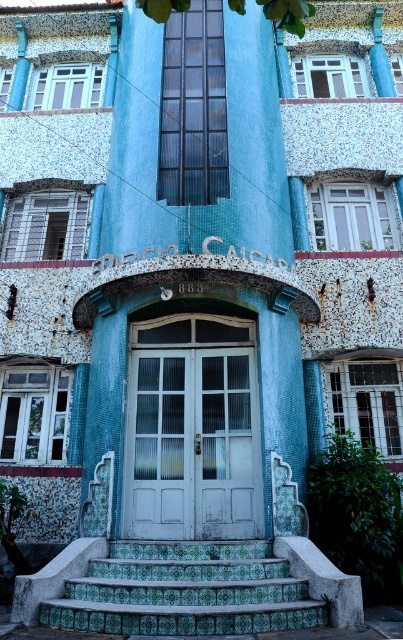
Question: Which of the following is the farthest from the observer?

Choices:
 (A) (203, 340)
 (B) (87, 595)

Answer: (A)

Question: Is white matte door at center bigger than green tile stairs at center?

Choices:
 (A) no
 (B) yes

Answer: (B)

Question: Is white matte door at center smaller than green tile stairs at center?

Choices:
 (A) no
 (B) yes

Answer: (A)

Question: Which of the following is the closest to the observer?

Choices:
 (A) (122, 561)
 (B) (157, 419)

Answer: (A)

Question: Is white matte door at center below green tile stairs at center?

Choices:
 (A) no
 (B) yes

Answer: (A)

Question: Which object appears farthest from the camera in this image?

Choices:
 (A) green tile stairs at center
 (B) white matte door at center

Answer: (B)